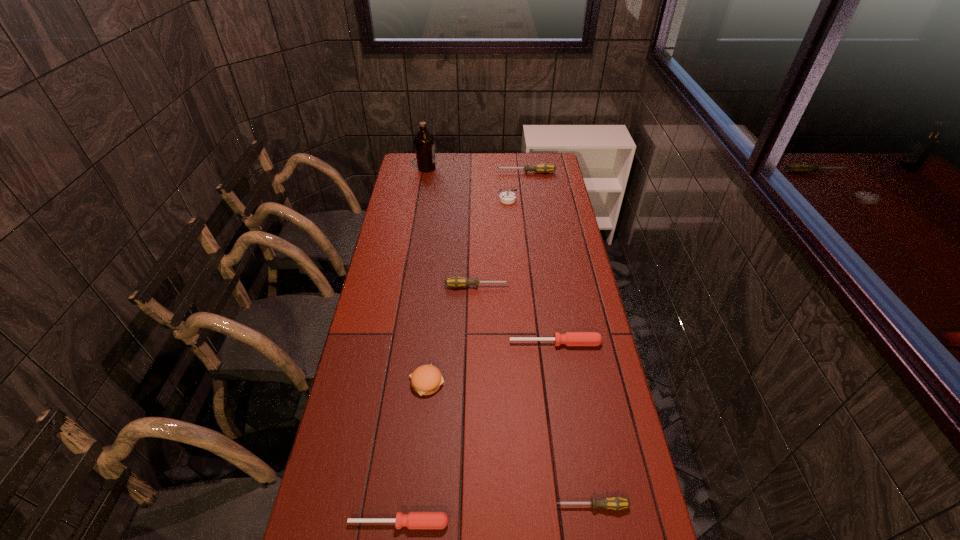
Locate an element on the screen. object that is at the far left corner is located at coordinates (424, 142).

Where is `object that is positioned at the far right corner`? This screenshot has height=540, width=960. object that is positioned at the far right corner is located at coordinates (543, 167).

Where is `free region at the far edge`? The height and width of the screenshot is (540, 960). free region at the far edge is located at coordinates (473, 160).

I want to click on free location at the left edge of the desktop, so click(405, 270).

This screenshot has height=540, width=960. In the image, there is a desktop. In order to click on free region at the right edge in this screenshot , I will do `click(542, 182)`.

You are a GUI agent. You are given a task and a screenshot of the screen. Output one action in this format:
    pyautogui.click(x=<x>, y=<y>)
    Task: Click on the vacant space at the far left corner of the desktop
    The height and width of the screenshot is (540, 960).
    Given the screenshot: What is the action you would take?
    pyautogui.click(x=414, y=162)

At what (x,y) coordinates should I click in order to perform the action: click on vacant area between the brown olive oil and the sixth nearest object. Please return your answer as a coordinate pair (x, y). The width and height of the screenshot is (960, 540). Looking at the image, I should click on (467, 184).

The image size is (960, 540). I want to click on free point between the fourth farthest screwdriver and the brown olive oil, so click(x=510, y=337).

Locate an element on the screen. The height and width of the screenshot is (540, 960). empty space that is in between the biggest gray screwdriver and the left red screwdriver is located at coordinates (462, 348).

Where is `free area in between the second farthest gray screwdriver and the compass`? The height and width of the screenshot is (540, 960). free area in between the second farthest gray screwdriver and the compass is located at coordinates (492, 243).